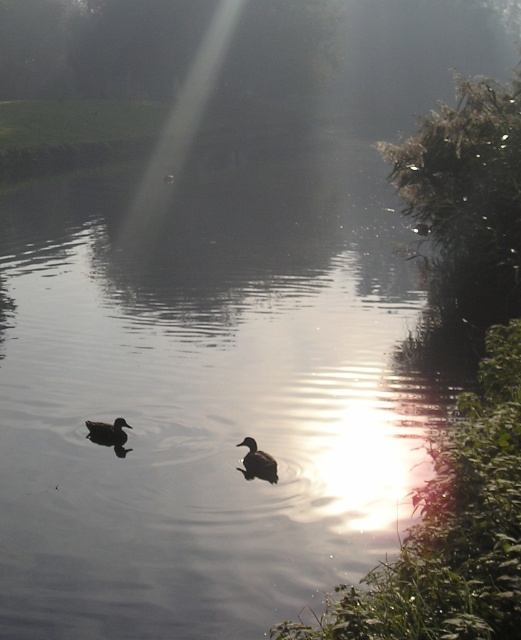
Question: Which object appears farthest from the camera in this image?

Choices:
 (A) dark brown duck at lower left
 (B) smooth dark water at center

Answer: (A)

Question: Which is nearer to the dark brown duck at lower left?

Choices:
 (A) brown matte duck at center
 (B) smooth dark water at center

Answer: (A)

Question: Can you confirm if smooth dark water at center is smaller than brown matte duck at center?

Choices:
 (A) yes
 (B) no

Answer: (B)

Question: Is brown matte duck at center thinner than dark brown duck at lower left?

Choices:
 (A) yes
 (B) no

Answer: (A)

Question: Does smooth dark water at center have a larger size compared to dark brown duck at lower left?

Choices:
 (A) yes
 (B) no

Answer: (A)

Question: Among these points, which one is nearest to the camera?

Choices:
 (A) (102, 428)
 (B) (11, 451)

Answer: (B)